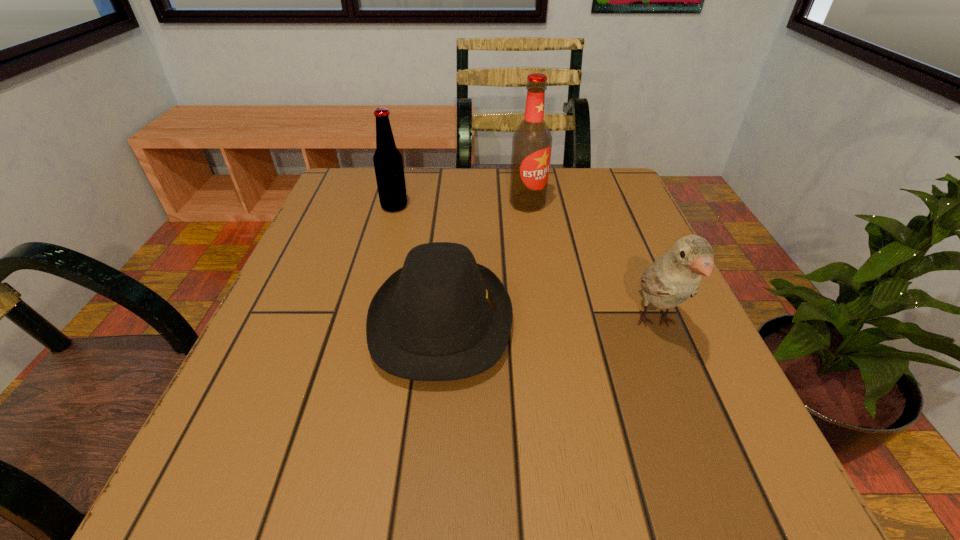
Identify the location of the right beer bottle. The height and width of the screenshot is (540, 960). (531, 144).

Where is `the tallest object`? Image resolution: width=960 pixels, height=540 pixels. the tallest object is located at coordinates (531, 144).

Where is `the shorter beer bottle`? The height and width of the screenshot is (540, 960). the shorter beer bottle is located at coordinates (388, 164).

The width and height of the screenshot is (960, 540). Find the location of `bird`. bird is located at coordinates (675, 276).

This screenshot has height=540, width=960. In order to click on the shortest object in this screenshot , I will do `click(441, 317)`.

I want to click on vacant space located on the right of the right beer bottle, so click(x=638, y=204).

Locate an element on the screen. free region located on the right of the shorter beer bottle is located at coordinates (502, 207).

At what (x,y) coordinates should I click in order to perform the action: click on vacant space located 0.090m at the face of the bird. Please return your answer as a coordinate pair (x, y). The image size is (960, 540). Looking at the image, I should click on click(692, 414).

Image resolution: width=960 pixels, height=540 pixels. I want to click on free location located 0.100m on the front-facing side of the shortest object, so click(570, 322).

At what (x,y) coordinates should I click in order to perform the action: click on object situated at the left edge. Please return your answer as a coordinate pair (x, y). The width and height of the screenshot is (960, 540). Looking at the image, I should click on (388, 164).